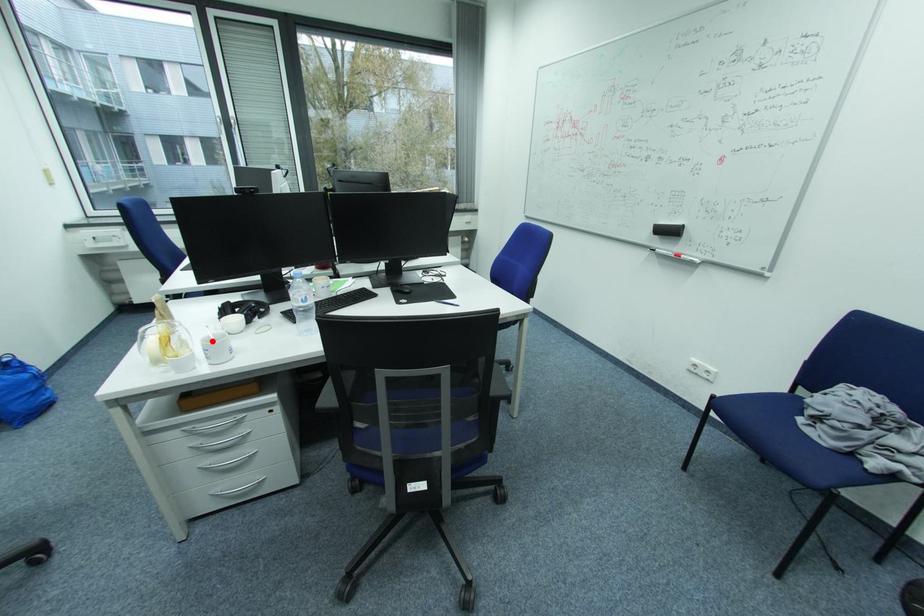
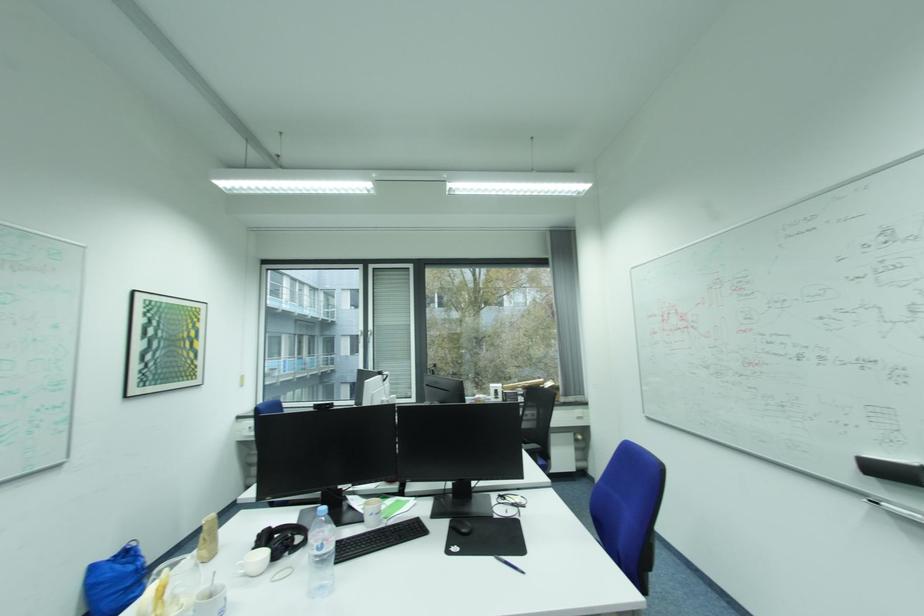
Find the pixel in the second image that matches the highlighted location in the first image.

(205, 596)